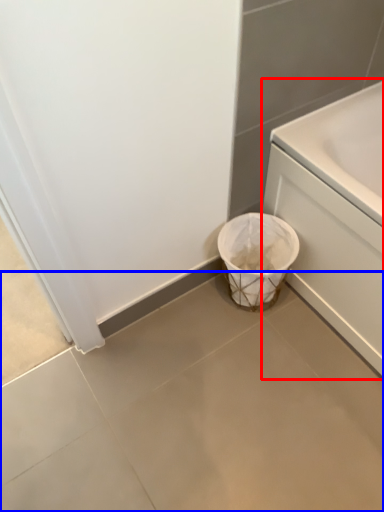
Question: Among these objects, which one is nearest to the camera, bath (highlighted by a red box) or concrete (highlighted by a blue box)?

Choices:
 (A) bath
 (B) concrete

Answer: (B)